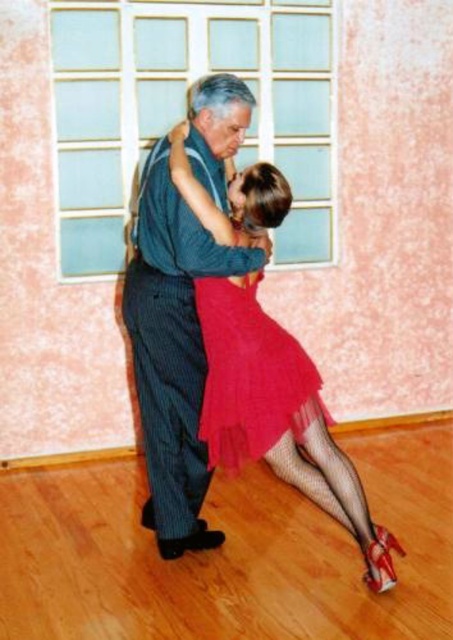
You are a photographer at a dance event. You want to capture a photo where the matte red dress at center and the striped fabric pants at center are visible. Based on their heights, which one should you focus on to ensure it appears taller in the photo?

The striped fabric pants at center are taller than the matte red dress at center, so focusing on the striped fabric pants at center would ensure it appears taller in the photo.

You are a photographer at a dance competition and need to capture the dancers in their best light. The judges want to see the details of both the matte red dress at center and the shiny tulle skirt at center. Since the lighting is better on the right side of the stage, which object should you focus on to ensure both are visible?

The shiny tulle skirt at center is on the right side of the matte red dress at center. Since the lighting is better on the right, focusing on the shiny tulle skirt at center will ensure both the matte red dress at center and the shiny tulle skirt at center are visible in good light.

You are a photographer capturing the dance duo. You notice the matte red dress at center and the striped fabric pants at center. Can you fit both subjects into a single frame without cropping either of them?

The distance between the matte red dress at center and striped fabric pants at center is 0.72 inches, so yes, you can fit both into a single frame without cropping either.